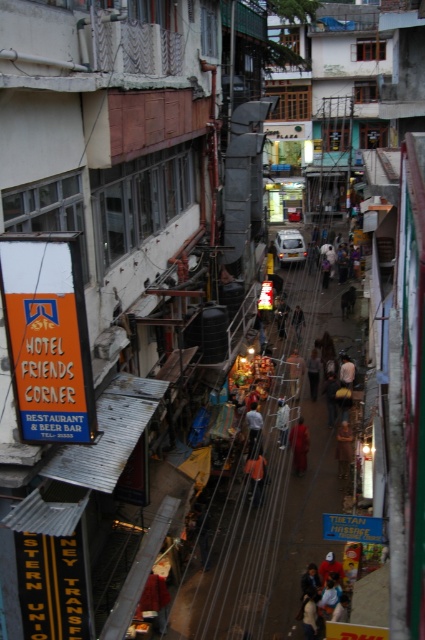
You are a delivery person trying to navigate through the narrow alleyway. You see an orange fabric person at center and a matte black jacket at center. Which object should you avoid stepping on to ensure you don not trip?

The orange fabric person at center is smaller than the matte black jacket at center, so you should avoid stepping on the matte black jacket at center as it is larger and more likely to cause a tripping hazard.

Looking at this image, you are a delivery person trying to locate two items in a cluttered alleyway. You see a dark brown leather jacket at center and a dark blue shirt at center. Which item is located to the right of the other?

The dark brown leather jacket at center is positioned on the right side of dark blue shirt at center, so the dark brown leather jacket at center is to the right of the dark blue shirt at center.